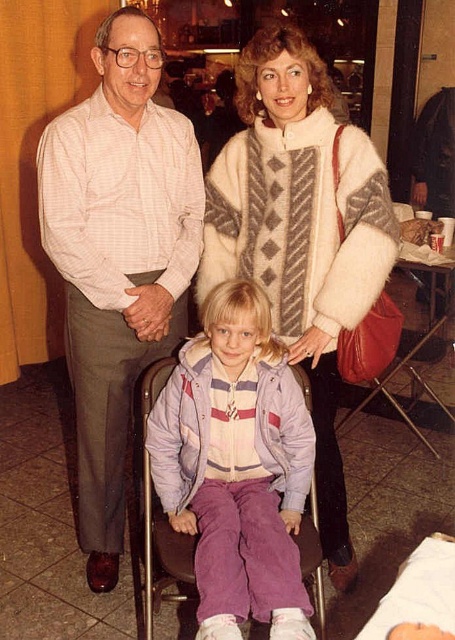
Question: Does fuzzy white coat at upper center appear on the left side of purple corduroy pants at center?

Choices:
 (A) no
 (B) yes

Answer: (A)

Question: Can you confirm if light pink checkered shirt at center is smaller than fuzzy white coat at upper center?

Choices:
 (A) no
 (B) yes

Answer: (A)

Question: Which point is farther from the camera taking this photo?

Choices:
 (A) (102, 282)
 (B) (206, 492)
 (C) (369, 259)

Answer: (A)

Question: Which is nearer to the fuzzy white coat at upper center?

Choices:
 (A) purple corduroy pants at center
 (B) light pink checkered shirt at center

Answer: (A)

Question: Among these objects, which one is nearest to the camera?

Choices:
 (A) fuzzy white coat at upper center
 (B) purple corduroy pants at center

Answer: (B)

Question: Does light pink checkered shirt at center have a smaller size compared to purple corduroy pants at center?

Choices:
 (A) no
 (B) yes

Answer: (A)